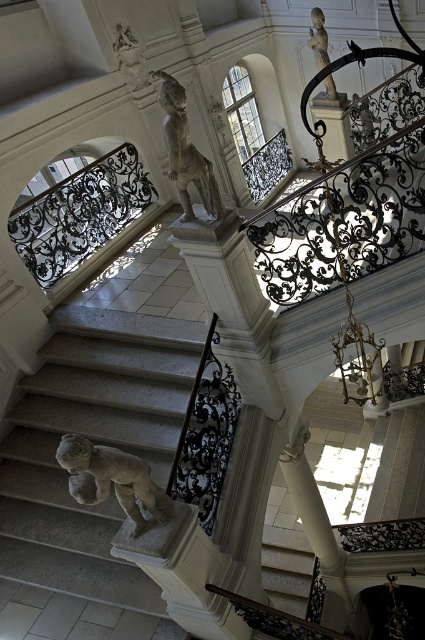
You are standing at the base of the staircase and want to determine which of the two points, point (84,484) or point (172,129), is nearer to you. Based on the image, which point is closer?

Point (84,484) is closer to the viewer than point (172,129), so the first point is nearer.

You are an interior designer planning to install a new light fixture between the white stone statue at center and the matte white statue at upper center. The fixture requires a minimum of 6 feet of space between the two statues to be safely installed. Based on the current distance, will the installation be possible?

The white stone statue at center is 5.94 feet from the matte white statue at upper center. Since the required minimum space is 6 feet, the installation will not be possible as the distance is slightly less than required.